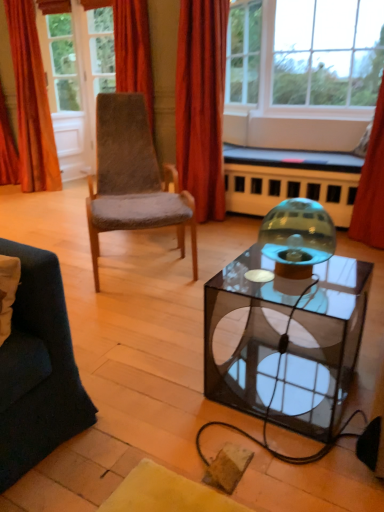
Locate an element on the screen. The image size is (384, 512). vacant space that is to the left of brown fuzzy chair at center is located at coordinates point(62,232).